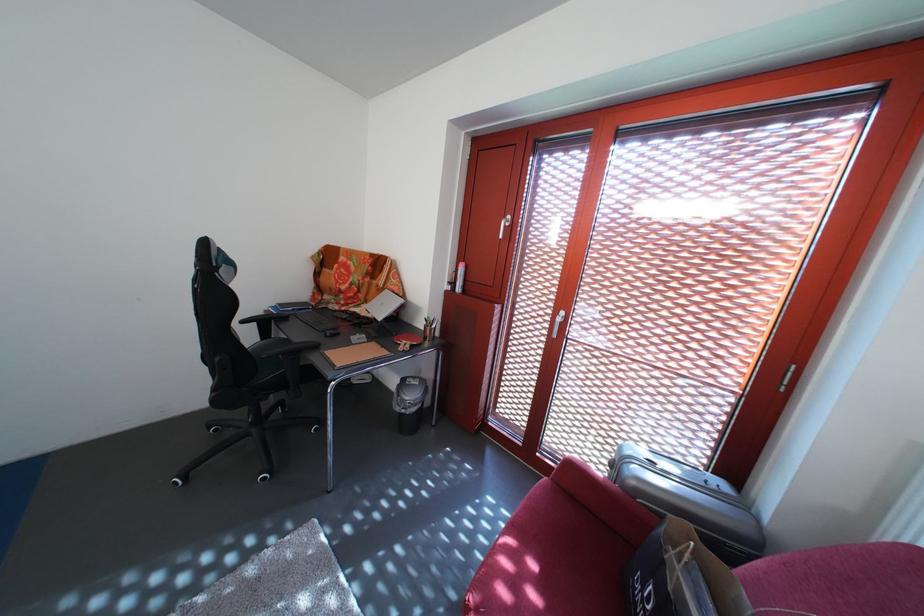
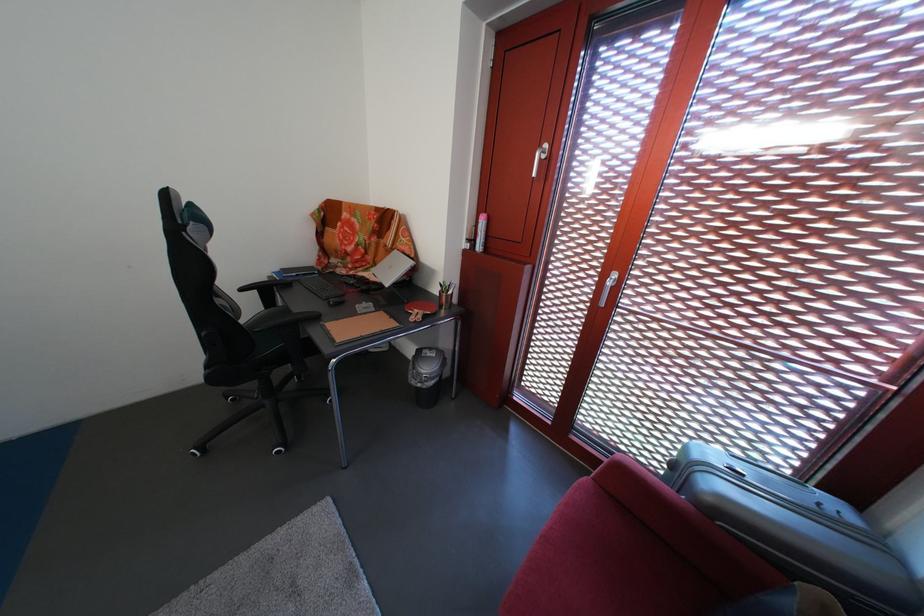
Where in the second image is the point corresponding to the point at 460,290 from the first image?

(479, 246)